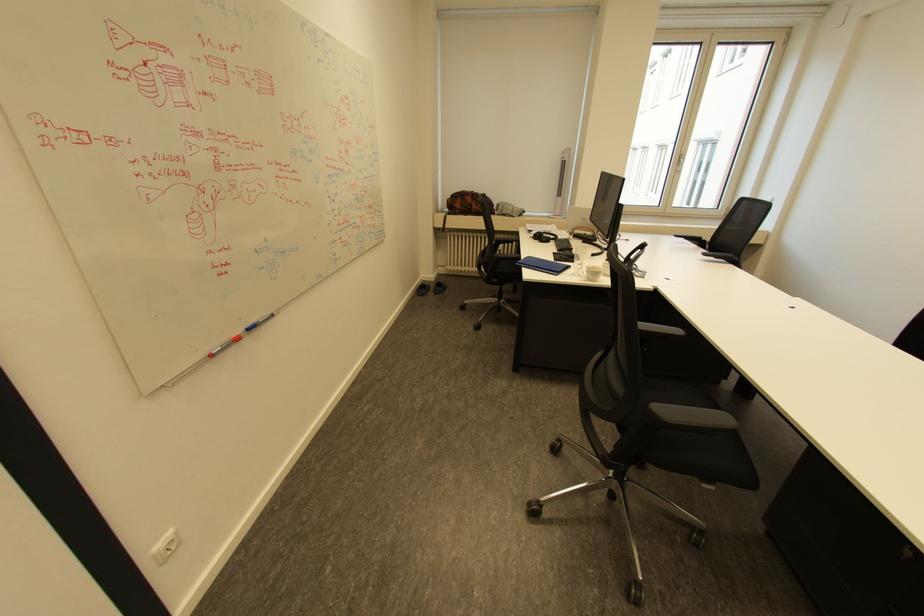
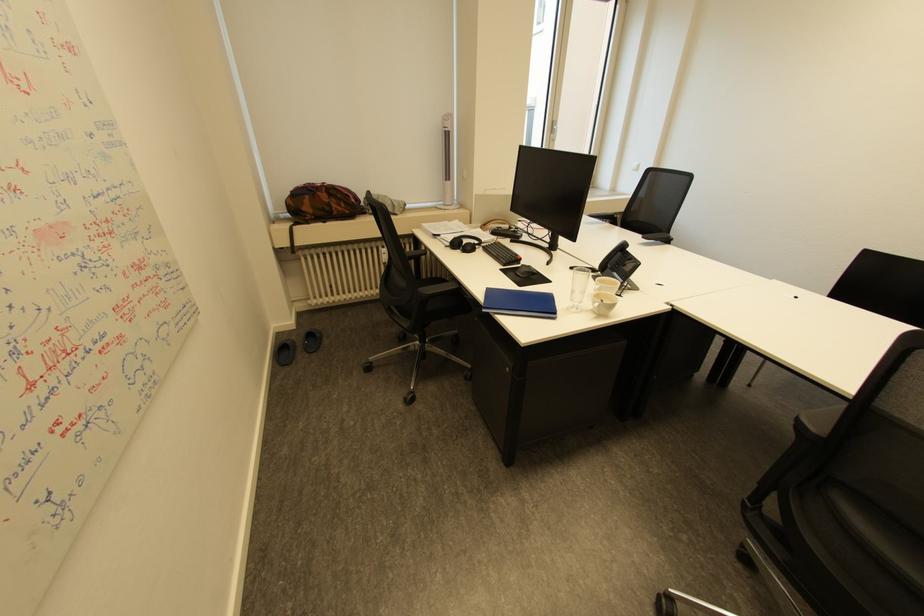
In the second image, find the point that corresponds to point 423,293 in the first image.

(284, 361)